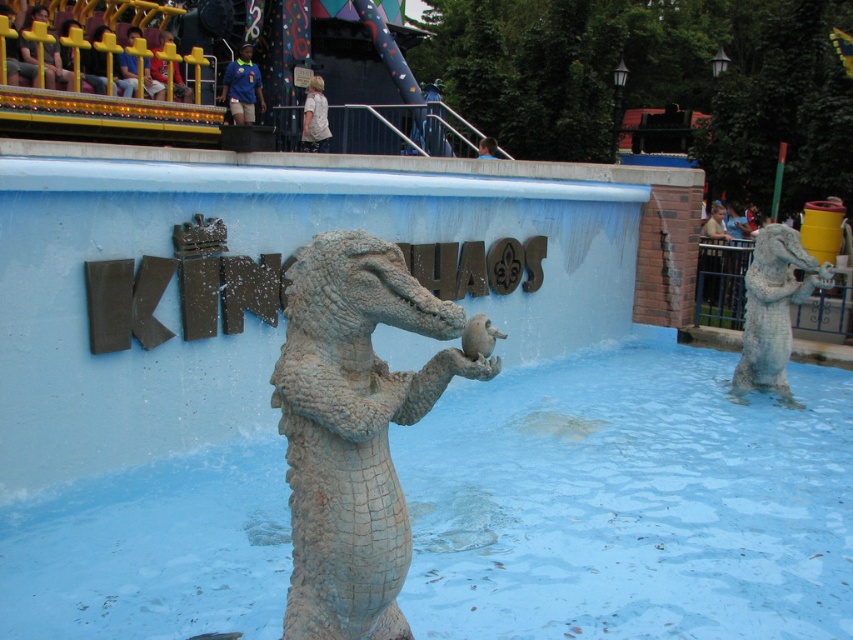
Is gray stone statue at center shorter than matte gray statue at center?

Incorrect, gray stone statue at center's height does not fall short of matte gray statue at center's.

Does point (751, 356) lie in front of point (480, 339)?

No, (751, 356) is behind (480, 339).

Locate an element on the screen. Image resolution: width=853 pixels, height=640 pixels. gray stone statue at center is located at coordinates (773, 308).

Locate an element on the screen. gray stone statue at center is located at coordinates (773, 308).

Which is more to the left, gray stone crocodile at center or matte gray statue at center?

Positioned to the left is gray stone crocodile at center.

Is point (381, 272) farther from camera compared to point (465, 349)?

No, it is in front of (465, 349).

Between point (328, 460) and point (480, 316), which one is positioned behind?

Positioned behind is point (480, 316).

What are the coordinates of `gray stone crocodile at center` in the screenshot? It's located at (352, 429).

Can you confirm if gray stone crocodile at center is smaller than gray stone statue at center?

Yes, gray stone crocodile at center is smaller than gray stone statue at center.

Can you confirm if gray stone crocodile at center is shorter than gray stone statue at center?

Correct, gray stone crocodile at center is not as tall as gray stone statue at center.

Describe the element at coordinates (352, 429) in the screenshot. This screenshot has height=640, width=853. I see `gray stone crocodile at center` at that location.

Identify the location of gray stone crocodile at center. This screenshot has width=853, height=640. (352, 429).